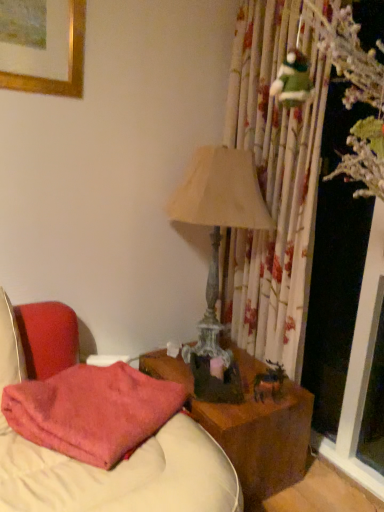
Question: Could you tell me if pink fuzzy pillow at lower left is turned towards matte beige lampshade at center-right?

Choices:
 (A) yes
 (B) no

Answer: (B)

Question: Is pink fuzzy pillow at lower left further to the viewer compared to matte beige lampshade at center-right?

Choices:
 (A) no
 (B) yes

Answer: (A)

Question: From the image's perspective, is pink fuzzy pillow at lower left over matte beige lampshade at center-right?

Choices:
 (A) yes
 (B) no

Answer: (B)

Question: Would you say pink fuzzy pillow at lower left contains matte beige lampshade at center-right?

Choices:
 (A) yes
 (B) no

Answer: (B)

Question: From the image's perspective, is pink fuzzy pillow at lower left located beneath matte beige lampshade at center-right?

Choices:
 (A) yes
 (B) no

Answer: (A)

Question: Is there a large distance between pink fuzzy pillow at lower left and matte beige lampshade at center-right?

Choices:
 (A) yes
 (B) no

Answer: (B)

Question: From a real-world perspective, is matte beige lampshade at center-right positioned under wooden nightstand at center based on gravity?

Choices:
 (A) no
 (B) yes

Answer: (A)

Question: Are matte beige lampshade at center-right and wooden nightstand at center beside each other?

Choices:
 (A) yes
 (B) no

Answer: (B)

Question: Is matte beige lampshade at center-right taller than wooden nightstand at center?

Choices:
 (A) yes
 (B) no

Answer: (A)

Question: From a real-world perspective, is matte beige lampshade at center-right over wooden nightstand at center?

Choices:
 (A) no
 (B) yes

Answer: (B)

Question: Is matte beige lampshade at center-right facing towards wooden nightstand at center?

Choices:
 (A) yes
 (B) no

Answer: (B)

Question: Considering the relative positions of matte beige lampshade at center-right and wooden nightstand at center in the image provided, is matte beige lampshade at center-right in front of wooden nightstand at center?

Choices:
 (A) no
 (B) yes

Answer: (A)

Question: Is wooden nightstand at center shorter than matte beige lampshade at center-right?

Choices:
 (A) yes
 (B) no

Answer: (A)